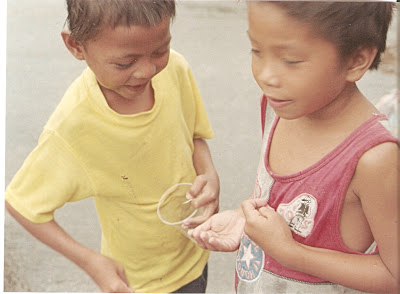
In order to click on cup in this screenshot , I will do `click(163, 217)`.